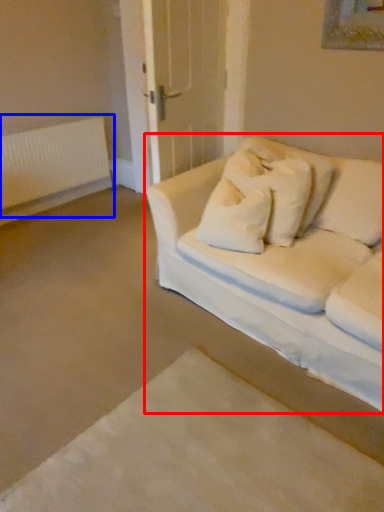
Question: Among these objects, which one is nearest to the camera, studio couch (highlighted by a red box) or radiator (highlighted by a blue box)?

Choices:
 (A) studio couch
 (B) radiator

Answer: (A)